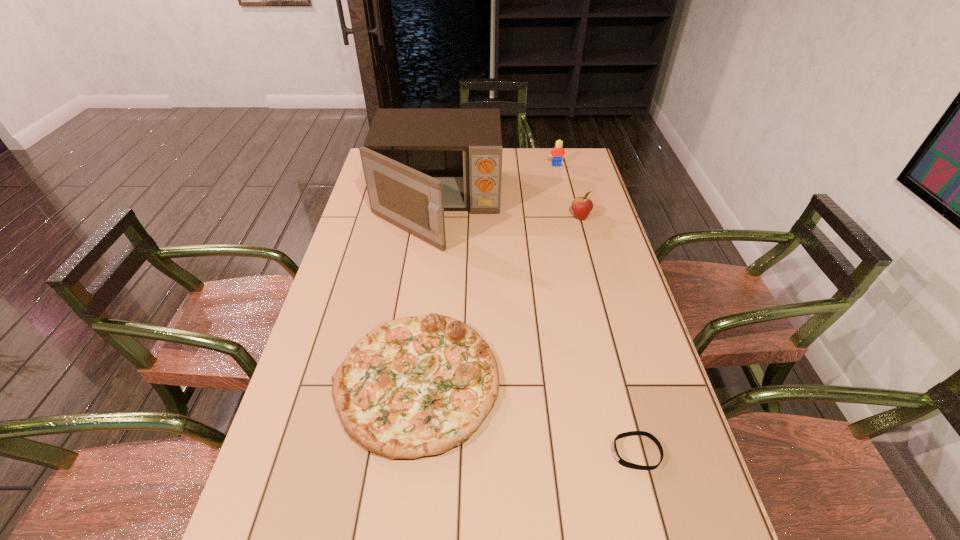
Image resolution: width=960 pixels, height=540 pixels. Identify the location of microwave oven. (417, 163).

Find the location of a particular element. Lego is located at coordinates (558, 152).

This screenshot has height=540, width=960. Identify the location of apple. (581, 206).

What are the coordinates of `pizza` in the screenshot? It's located at (413, 387).

Find the location of a particular element. the shortest object is located at coordinates (622, 462).

What are the coordinates of `vacant space located with the door open on the front of the tallest object` in the screenshot? It's located at (423, 318).

This screenshot has width=960, height=540. In order to click on vacant space positioned on the face of the Lego in this screenshot , I will do `click(571, 227)`.

The width and height of the screenshot is (960, 540). I want to click on free space located 0.220m on the back of the apple, so click(x=569, y=178).

Find the location of a particular element. The image size is (960, 540). vacant space located 0.070m on the back of the second shortest object is located at coordinates (426, 302).

The height and width of the screenshot is (540, 960). I want to click on free space located on the display of the shortest object, so click(x=423, y=453).